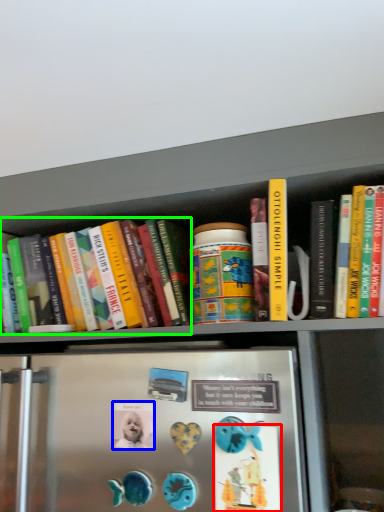
Question: Considering the real-world distances, which object is closest to button (highlighted by a red box)? button (highlighted by a blue box) or book (highlighted by a green box).

Choices:
 (A) button
 (B) book

Answer: (A)